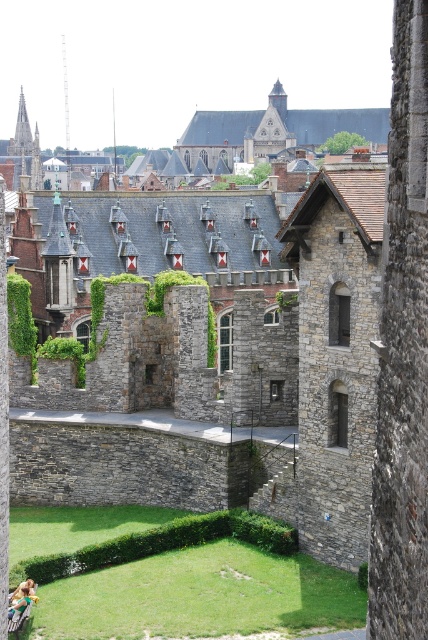
Is the position of green grass at lower center more distant than that of smooth stone spire at upper left?

No, green grass at lower center is closer to the viewer.

Which of these two, green grass at lower center or smooth stone spire at upper left, stands shorter?

green grass at lower center is shorter.

Between point (89, 556) and point (8, 176), which one is positioned behind?

Positioned behind is point (8, 176).

The height and width of the screenshot is (640, 428). In order to click on green grass at lower center in this screenshot , I will do `click(162, 544)`.

Does smooth stone spire at upper left come in front of wooden park bench at lower left?

No, smooth stone spire at upper left is behind wooden park bench at lower left.

Measure the distance from smooth stone spire at upper left to wooden park bench at lower left.

136.49 meters

Is point (32, 164) closer to viewer compared to point (18, 604)?

No, (32, 164) is behind (18, 604).

Find the location of a particular element. This screenshot has width=428, height=640. smooth stone spire at upper left is located at coordinates (23, 154).

Between green grass at lower center and wooden park bench at lower left, which one has more height?

With more height is green grass at lower center.

Between green grass at lower center and wooden park bench at lower left, which one is positioned lower?

wooden park bench at lower left is below.

Between point (246, 513) and point (20, 602), which one is positioned behind?

The point (246, 513) is more distant.

Where is `green grass at lower center`? green grass at lower center is located at coordinates (162, 544).